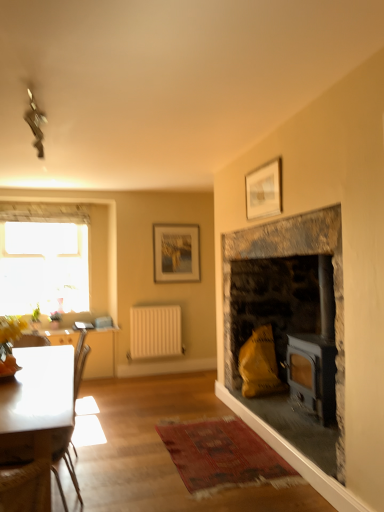
Question: Is white glossy table at left to the left or to the right of white matte radiator at center in the image?

Choices:
 (A) right
 (B) left

Answer: (B)

Question: From their relative heights in the image, would you say white glossy table at left is taller or shorter than white matte radiator at center?

Choices:
 (A) short
 (B) tall

Answer: (A)

Question: Estimate the real-world distances between objects in this image. Which object is farther from the stone fireplace at right?

Choices:
 (A) transparent glass window at upper left
 (B) white glossy table at left
 (C) matte silver picture frame at upper center, the second picture frame when ordered from back to front
 (D) matte wooden picture frame at upper center, positioned as the 1th picture frame in bottom-to-top order
 (E) white glossy coffee table at lower left

Answer: (A)

Question: Which object is positioned farthest from the matte wooden picture frame at upper center, which is the 2th picture frame in front-to-back order?

Choices:
 (A) matte silver picture frame at upper center, the first picture frame positioned from the right
 (B) stone fireplace at right
 (C) transparent glass window at upper left
 (D) white glossy coffee table at lower left
 (E) white matte radiator at center

Answer: (D)